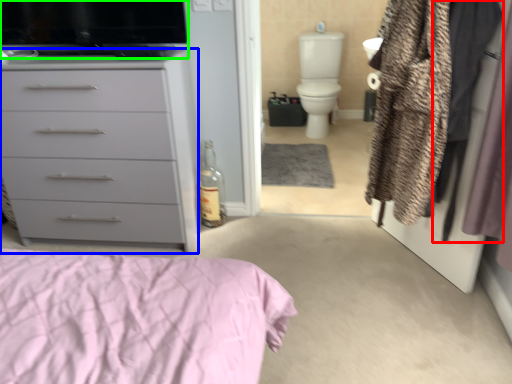
Question: Which object is positioned farthest from clothing (highlighted by a red box)? Select from chest of drawers (highlighted by a blue box) and appliance (highlighted by a green box).

Choices:
 (A) chest of drawers
 (B) appliance

Answer: (A)